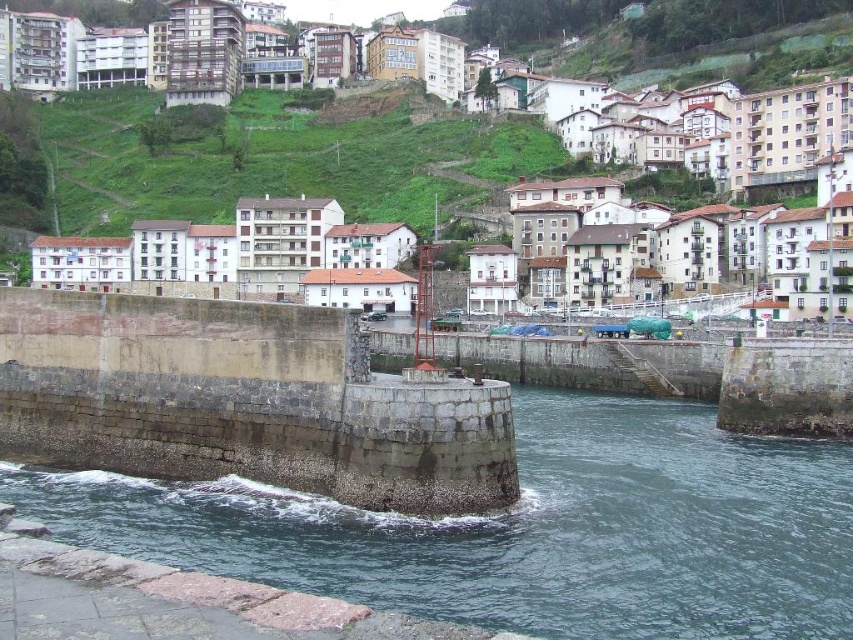
You are a tourist standing at the harbor entrance and want to take a photo that includes both the white stone buildings at center and the green grassy hillside at upper center. Based on their sizes, which one should you focus on to ensure both are visible in the frame?

The white stone buildings at center are larger in size compared to the green grassy hillside at upper center. To ensure both are visible, focus on the white stone buildings at center as the primary subject, and position the green grassy hillside at upper center in the background or corner of the frame.

You are a photographer planning to capture the entire scene of the coastal town. You notice the dark gray stone river at center and the green grassy hillside at upper center. Which of these two features appears narrower in the image?

The dark gray stone river at center has a lesser width compared to the green grassy hillside at upper center, so the dark gray stone river at center appears narrower in the image.